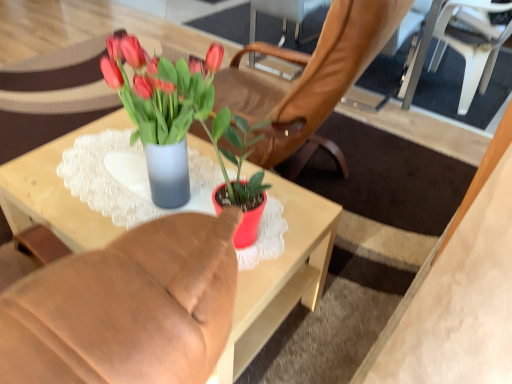
What do you see at coordinates (281, 275) in the screenshot? This screenshot has width=512, height=384. I see `matte glass vase at center` at bounding box center [281, 275].

Measure the distance between point (78, 130) and camera.

The distance of point (78, 130) from camera is 1.43 meters.

Where is `matte glass vase at center`? This screenshot has height=384, width=512. matte glass vase at center is located at coordinates (281, 275).

This screenshot has width=512, height=384. Describe the element at coordinates (459, 49) in the screenshot. I see `white plastic chair at upper right` at that location.

Locate an element on the screen. The image size is (512, 384). white plastic chair at upper right is located at coordinates (459, 49).

Where is `matte glass vase at center`? The image size is (512, 384). matte glass vase at center is located at coordinates (281, 275).

Is matte glass vase at center at the right side of white plastic chair at upper right?

Incorrect, matte glass vase at center is not on the right side of white plastic chair at upper right.

Looking at this image, is the depth of matte glass vase at center less than that of white plastic chair at upper right?

Yes, it is in front of white plastic chair at upper right.

Is point (218, 377) closer or farther from the camera than point (480, 90)?

Point (218, 377) appears to be closer to the viewer than point (480, 90).

From the image's perspective, between matte glass vase at center and white plastic chair at upper right, which one is located above?

white plastic chair at upper right, from the image's perspective.

From a real-world perspective, is matte glass vase at center over white plastic chair at upper right?

No.

Does matte glass vase at center have a lesser width compared to white plastic chair at upper right?

No.

Can you confirm if matte glass vase at center is taller than white plastic chair at upper right?

Incorrect, the height of matte glass vase at center is not larger of that of white plastic chair at upper right.

Looking at this image, is matte glass vase at center bigger than white plastic chair at upper right?

Incorrect, matte glass vase at center is not larger than white plastic chair at upper right.

Is white plastic chair at upper right inside matte glass vase at center?

No, white plastic chair at upper right is not surrounded by matte glass vase at center.

Based on the photo, is matte glass vase at center beside white plastic chair at upper right?

matte glass vase at center and white plastic chair at upper right are not in contact.

Is matte glass vase at center facing away from white plastic chair at upper right?

No, matte glass vase at center's orientation is not away from white plastic chair at upper right.

I want to click on desk lying in front of the white plastic chair at upper right, so click(x=281, y=275).

Does white plastic chair at upper right appear on the right side of matte glass vase at center?

Yes.

Is white plastic chair at upper right in front of or behind matte glass vase at center in the image?

white plastic chair at upper right is positioned farther from the viewer than matte glass vase at center.

Is point (496, 43) farther from viewer compared to point (287, 219)?

Yes.

From the image's perspective, relative to matte glass vase at center, is white plastic chair at upper right above or below?

From the image's perspective, white plastic chair at upper right appears above matte glass vase at center.

From a real-world perspective, between white plastic chair at upper right and matte glass vase at center, who is vertically higher?

white plastic chair at upper right, from a real-world perspective.

Considering the sizes of objects white plastic chair at upper right and matte glass vase at center in the image provided, who is wider, white plastic chair at upper right or matte glass vase at center?

matte glass vase at center is wider.

Between white plastic chair at upper right and matte glass vase at center, which one has less height?

Standing shorter between the two is matte glass vase at center.

Looking at the image, does white plastic chair at upper right seem bigger or smaller compared to matte glass vase at center?

Clearly, white plastic chair at upper right is larger in size than matte glass vase at center.

Would you say white plastic chair at upper right is inside or outside matte glass vase at center?

white plastic chair at upper right is not inside matte glass vase at center, it's outside.

Are white plastic chair at upper right and matte glass vase at center far apart?

Yes, white plastic chair at upper right and matte glass vase at center are quite far apart.

Is white plastic chair at upper right positioned with its back to matte glass vase at center?

That's not correct — white plastic chair at upper right is not looking away from matte glass vase at center.

How many degrees apart are the facing directions of white plastic chair at upper right and matte glass vase at center?

2.11 degrees.

I want to click on desk lying below the white plastic chair at upper right (from the image's perspective), so [281, 275].

Where is `desk below the white plastic chair at upper right (from the image's perspective)`? The width and height of the screenshot is (512, 384). desk below the white plastic chair at upper right (from the image's perspective) is located at coordinates (281, 275).

I want to click on chair on the right of matte glass vase at center, so click(459, 49).